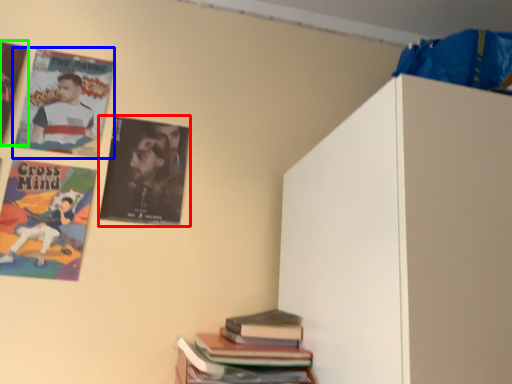
Question: Which object is positioned closest to poster (highlighted by a red box)? Select from poster (highlighted by a blue box) and poster (highlighted by a green box).

Choices:
 (A) poster
 (B) poster

Answer: (A)